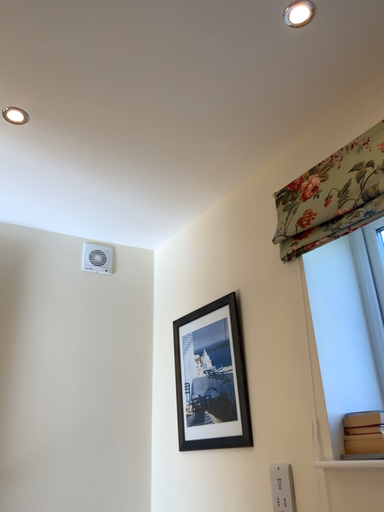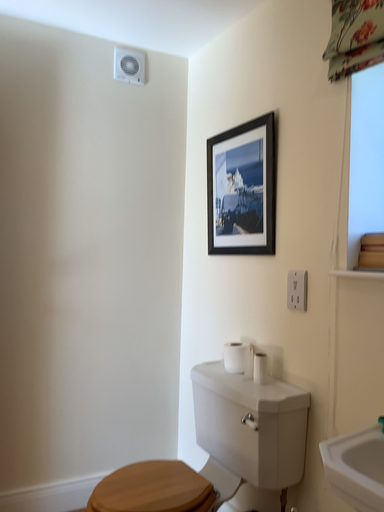
Question: Which way did the camera rotate in the video?

Choices:
 (A) rotated downward
 (B) rotated upward

Answer: (A)